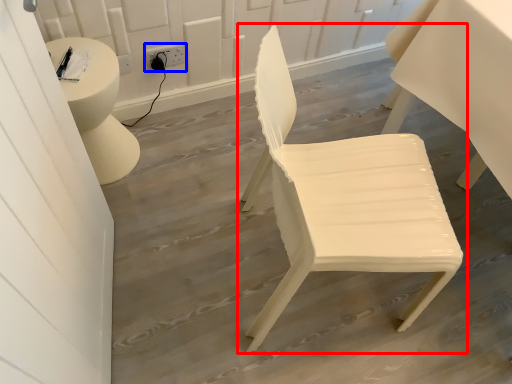
Question: Which point is further to the camera, chair (highlighted by a red box) or electric outlet (highlighted by a blue box)?

Choices:
 (A) chair
 (B) electric outlet

Answer: (B)